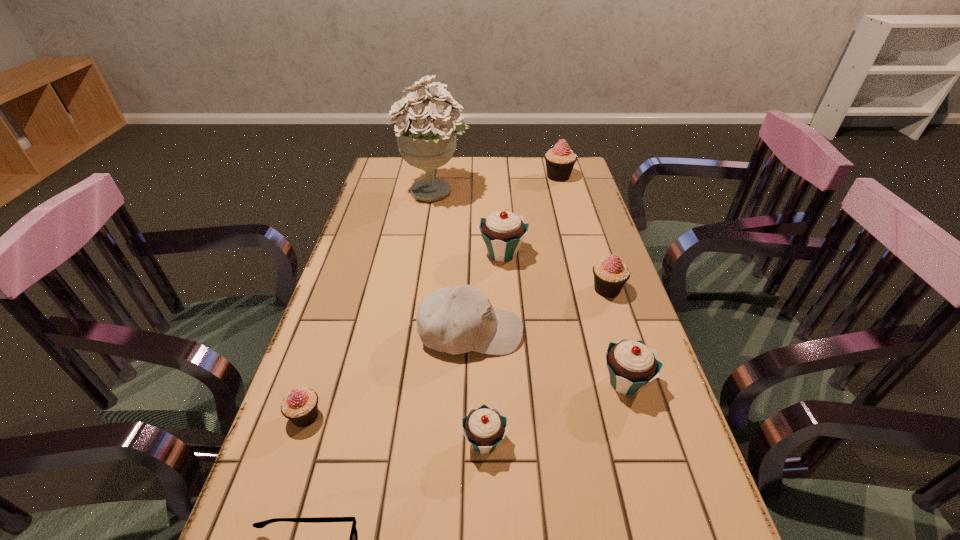
Where is `the rightmost teal cupcake`? This screenshot has width=960, height=540. the rightmost teal cupcake is located at coordinates (631, 365).

Identify the location of the second farthest teal cupcake. (631, 365).

Image resolution: width=960 pixels, height=540 pixels. Identify the location of the leftmost cupcake. (300, 406).

Where is `the smallest pink cupcake`? the smallest pink cupcake is located at coordinates (300, 406).

Find the location of a particular element. Image resolution: width=960 pixels, height=540 pixels. the nearest teal cupcake is located at coordinates (484, 428).

The width and height of the screenshot is (960, 540). What are the coordinates of `free space located on the left of the green bouquet` in the screenshot? It's located at (368, 191).

I want to click on free location located on the left of the farthest pink cupcake, so click(x=524, y=177).

The height and width of the screenshot is (540, 960). Find the location of `free region located 0.090m on the left of the fifth nearest cupcake`. free region located 0.090m on the left of the fifth nearest cupcake is located at coordinates (447, 253).

The width and height of the screenshot is (960, 540). In order to click on vacant region located 0.060m on the front-facing side of the baseball cap in this screenshot , I will do `click(547, 333)`.

Locate an element on the screen. Image resolution: width=960 pixels, height=540 pixels. vacant space located on the back of the fourth farthest object is located at coordinates (580, 205).